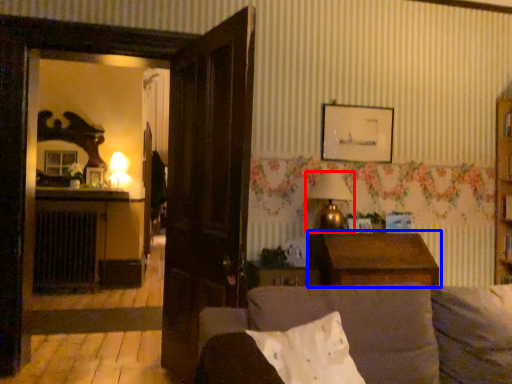
Question: Which of the following is the closest to the observer, lamp (highlighted by a red box) or table (highlighted by a blue box)?

Choices:
 (A) lamp
 (B) table

Answer: (B)